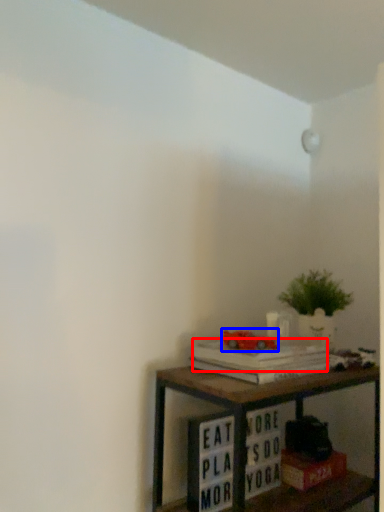
Question: Which point is closer to the camera, paperback book (highlighted by a red box) or toy (highlighted by a blue box)?

Choices:
 (A) paperback book
 (B) toy

Answer: (A)